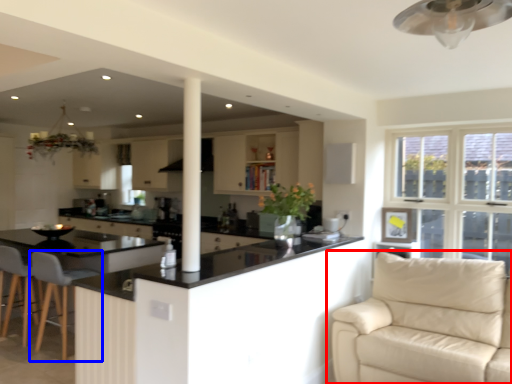
Question: Which object appears farthest to the camera in this image, studio couch (highlighted by a red box) or chair (highlighted by a blue box)?

Choices:
 (A) studio couch
 (B) chair

Answer: (B)